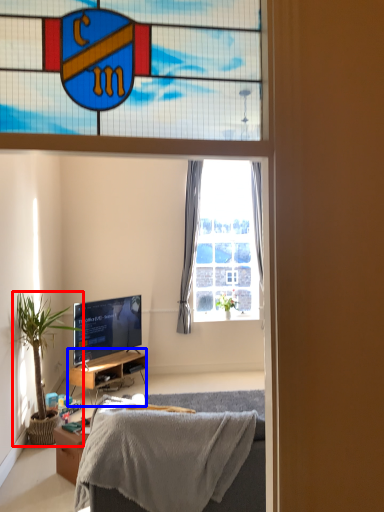
Question: Which object appears farthest to the camera in this image, houseplant (highlighted by a red box) or cabinetry (highlighted by a blue box)?

Choices:
 (A) houseplant
 (B) cabinetry

Answer: (B)